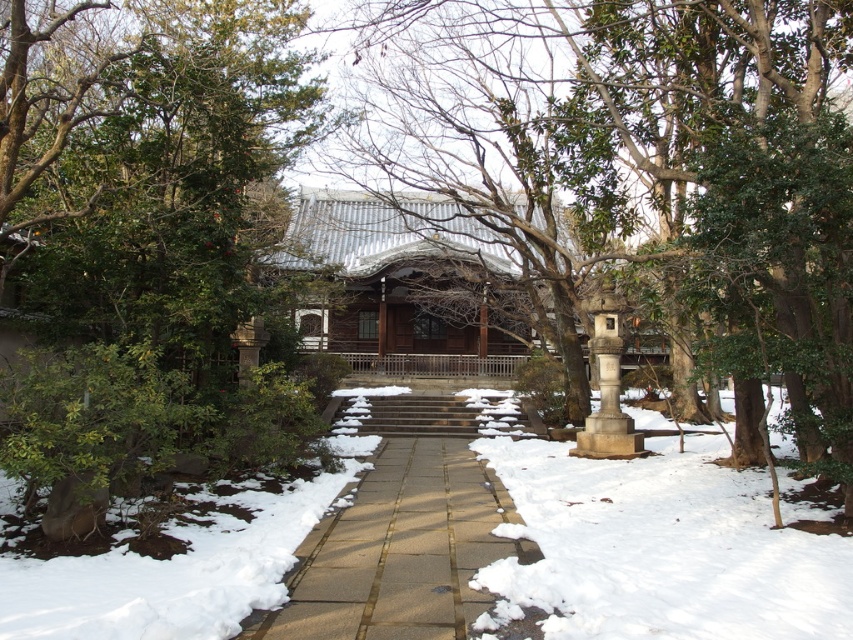
Question: Which point is farther from the camera taking this photo?

Choices:
 (A) (300, 316)
 (B) (604, 371)

Answer: (A)

Question: Where is smooth stone pathway at center located in relation to shiny silver gazebo at center in the image?

Choices:
 (A) below
 (B) above

Answer: (A)

Question: Can you confirm if smooth stone pathway at center is positioned to the left of shiny silver gazebo at center?

Choices:
 (A) yes
 (B) no

Answer: (B)

Question: Based on their relative distances, which object is nearer to the smooth stone pathway at center?

Choices:
 (A) gray stone lantern at center
 (B) green leafy tree at left
 (C) shiny silver gazebo at center

Answer: (A)

Question: Can you confirm if smooth stone pathway at center is positioned to the right of shiny silver gazebo at center?

Choices:
 (A) no
 (B) yes

Answer: (B)

Question: Estimate the real-world distances between objects in this image. Which object is farther from the smooth stone pathway at center?

Choices:
 (A) shiny silver gazebo at center
 (B) green leafy tree at left
 (C) gray stone lantern at center

Answer: (A)